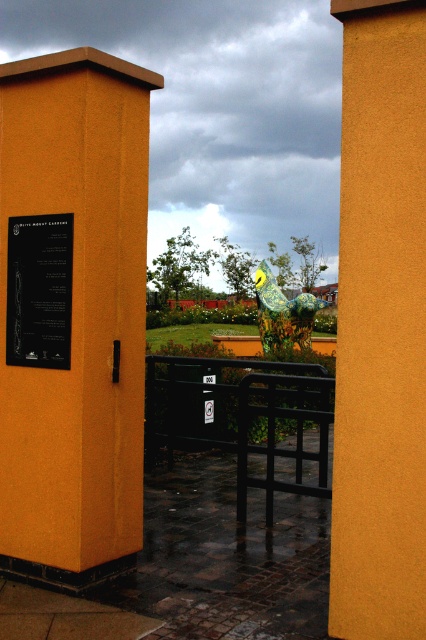
Question: Is matte yellow pillar at center below shiny metallic bird at center?

Choices:
 (A) yes
 (B) no

Answer: (A)

Question: Which object is positioned closest to the shiny metallic bird at center?

Choices:
 (A) black plastic sign at upper left
 (B) orange matte pillar at left
 (C) matte yellow pillar at center
 (D) black metal fence at center

Answer: (D)

Question: Which of the following is the farthest from the observer?

Choices:
 (A) (287, 305)
 (B) (261, 417)
 (C) (55, 342)
 (D) (22, 406)

Answer: (A)

Question: Which point is closer to the camera taking this photo?

Choices:
 (A) (94, 250)
 (B) (186, 368)
 (C) (419, 392)

Answer: (C)

Question: Is black metal rail at center above shiny metallic bird at center?

Choices:
 (A) no
 (B) yes

Answer: (A)

Question: Considering the relative positions of black metal fence at center and shiny metallic bird at center in the image provided, where is black metal fence at center located with respect to shiny metallic bird at center?

Choices:
 (A) right
 (B) left

Answer: (B)